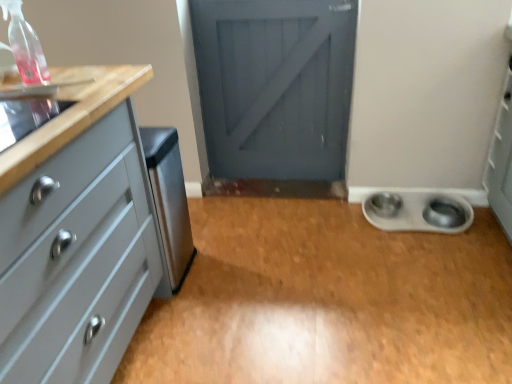
This screenshot has width=512, height=384. I want to click on free space between silver metallic bowls at lower right, which is the 1th appliance from back to front, and stainless steel trash can at left, which is counted as the 2th appliance, starting from the back, so click(296, 245).